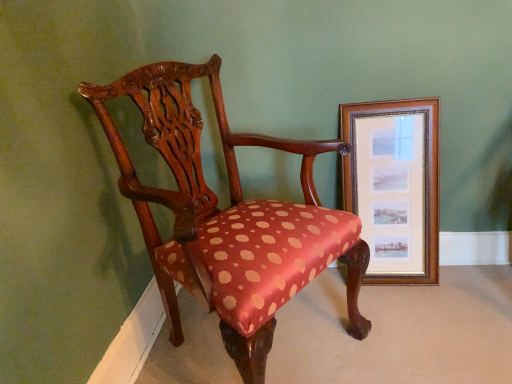
Identify the location of vacant area located to the right-hand side of polished wood chair at center. (415, 326).